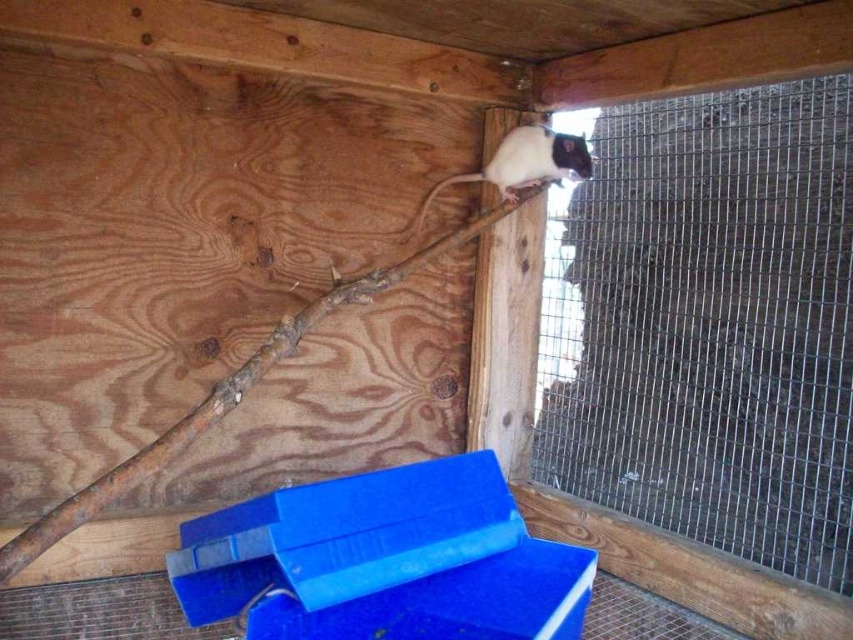
Question: In this image, where is blue plastic box at lower center located relative to white fur/black fur rat at upper right?

Choices:
 (A) right
 (B) left

Answer: (B)

Question: Does blue plastic box at lower center appear on the right side of white fur/black fur rat at upper right?

Choices:
 (A) yes
 (B) no

Answer: (B)

Question: Which point is closer to the camera?

Choices:
 (A) blue plastic box at lower center
 (B) white fur/black fur rat at upper right

Answer: (A)

Question: Which of the following is the farthest from the observer?

Choices:
 (A) white fur/black fur rat at upper right
 (B) blue plastic box at lower center

Answer: (A)

Question: Which object is farther from the camera taking this photo?

Choices:
 (A) blue plastic box at lower center
 (B) white fur/black fur rat at upper right

Answer: (B)

Question: Is blue plastic box at lower center further to the viewer compared to white fur/black fur rat at upper right?

Choices:
 (A) no
 (B) yes

Answer: (A)